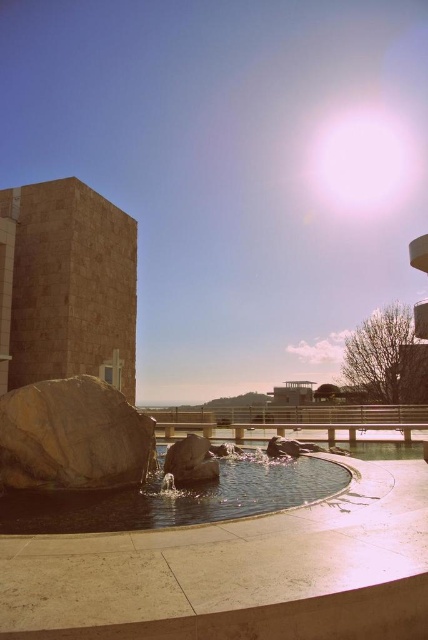
Question: Can you confirm if clear glass water at center is thinner than smooth gray rock at center?

Choices:
 (A) yes
 (B) no

Answer: (B)

Question: Which point appears closest to the camera in this image?

Choices:
 (A) (154, 524)
 (B) (205, 445)
 (C) (136, 458)

Answer: (A)

Question: Is rustic stone boulder at lower left to the right of smooth gray rock at center from the viewer's perspective?

Choices:
 (A) no
 (B) yes

Answer: (A)

Question: Which object appears farthest from the camera in this image?

Choices:
 (A) rustic stone boulder at lower left
 (B) smooth gray rock at center
 (C) clear glass water at center

Answer: (B)

Question: Is clear glass water at center closer to camera compared to rustic stone boulder at lower left?

Choices:
 (A) yes
 (B) no

Answer: (A)

Question: Which point is farther to the camera?

Choices:
 (A) clear glass water at center
 (B) smooth gray rock at center
 (C) rustic stone boulder at lower left

Answer: (B)